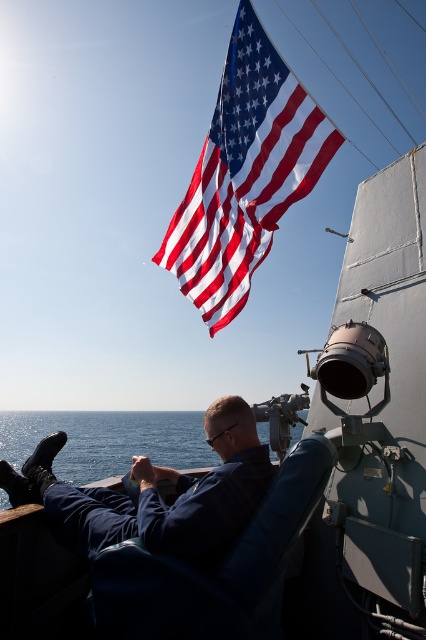
You are standing on the deck of the naval vessel and want to sit down. There is a blue fabric chair at center. Where exactly is the blue fabric chair at center located in relation to the point marked at coordinates (x=215, y=570)?

The point marked at coordinates (x=215, y=570) corresponds to the blue fabric chair at center, so the chair is exactly at that location.

You are on a naval vessel and need to sit down. There is a blue fabric chair at center and blue water at lower left. Which option is more suitable for sitting?

The blue fabric chair at center is more suitable for sitting because it has a smaller size compared to the blue water at lower left, which is likely not meant for sitting.